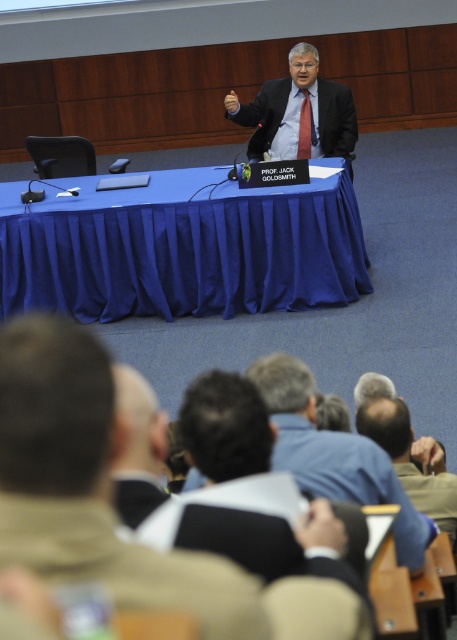
Question: Among these objects, which one is farthest from the camera?

Choices:
 (A) dark blue shirt at center
 (B) brown leather jacket at lower center
 (C) light brown leather jacket at lower right
 (D) blue fabric table at center

Answer: (D)

Question: Is blue fabric table at center positioned in front of brown leather jacket at lower center?

Choices:
 (A) no
 (B) yes

Answer: (A)

Question: Does blue fabric table at center have a smaller size compared to matte black suit at center?

Choices:
 (A) yes
 (B) no

Answer: (B)

Question: From the image, what is the correct spatial relationship of blue fabric table at center in relation to light brown leather jacket at lower right?

Choices:
 (A) right
 (B) left

Answer: (B)

Question: Which point appears farthest from the camera in this image?

Choices:
 (A) (383, 486)
 (B) (408, 481)
 (C) (12, 465)

Answer: (B)

Question: Estimate the real-world distances between objects in this image. Which object is closer to the light brown leather jacket at lower right?

Choices:
 (A) brown leather jacket at lower center
 (B) matte black suit at center

Answer: (A)